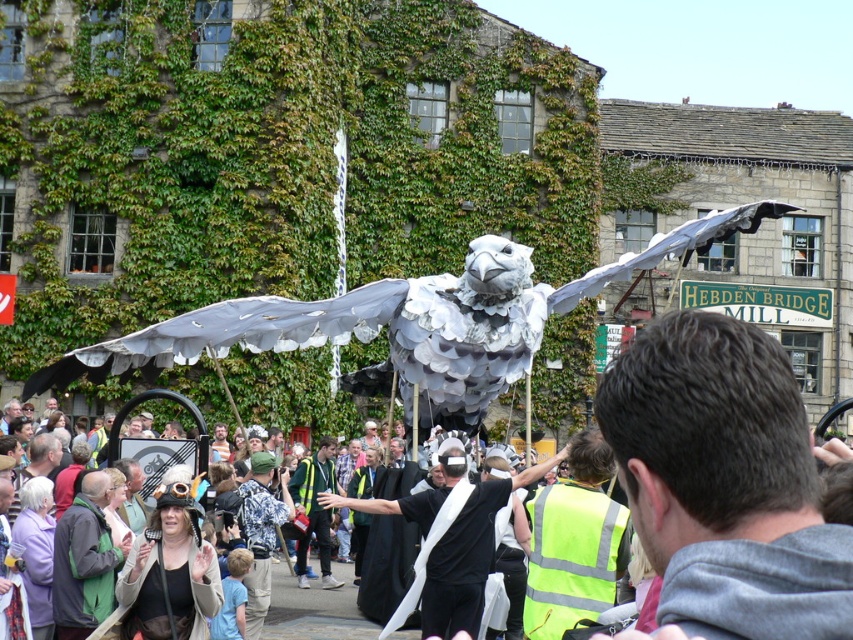
Image resolution: width=853 pixels, height=640 pixels. Describe the element at coordinates (405, 321) in the screenshot. I see `silver metallic eagle at center` at that location.

In the scene shown: Who is lower down, silver metallic eagle at center or white paper bird at center?

white paper bird at center is lower down.

The height and width of the screenshot is (640, 853). Identify the location of silver metallic eagle at center. (405, 321).

Which is in front, point (459, 340) or point (561, 634)?

Point (561, 634) is in front.

Can you confirm if silver metallic eagle at center is wider than high-visibility yellow vest at center?

Indeed, silver metallic eagle at center has a greater width compared to high-visibility yellow vest at center.

Which is behind, point (517, 355) or point (532, 531)?

Point (517, 355)

Identify the location of silver metallic eagle at center. The width and height of the screenshot is (853, 640). (405, 321).

What do you see at coordinates (724, 483) in the screenshot? This screenshot has width=853, height=640. I see `dark gray hair at center` at bounding box center [724, 483].

Locate an element on the screen. The image size is (853, 640). dark gray hair at center is located at coordinates (724, 483).

Identify the location of dark gray hair at center. (724, 483).